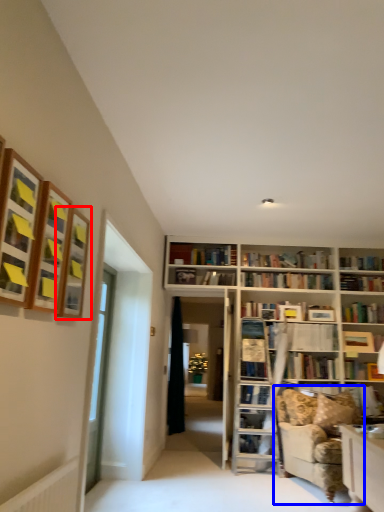
Question: Which object appears farthest to the camera in this image, shelf (highlighted by a red box) or studio couch (highlighted by a blue box)?

Choices:
 (A) shelf
 (B) studio couch

Answer: (B)